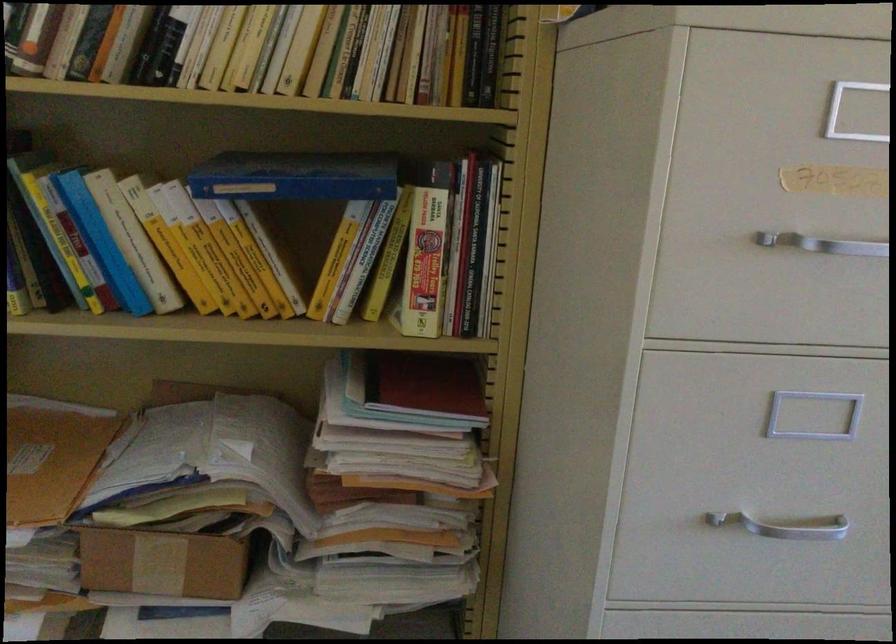
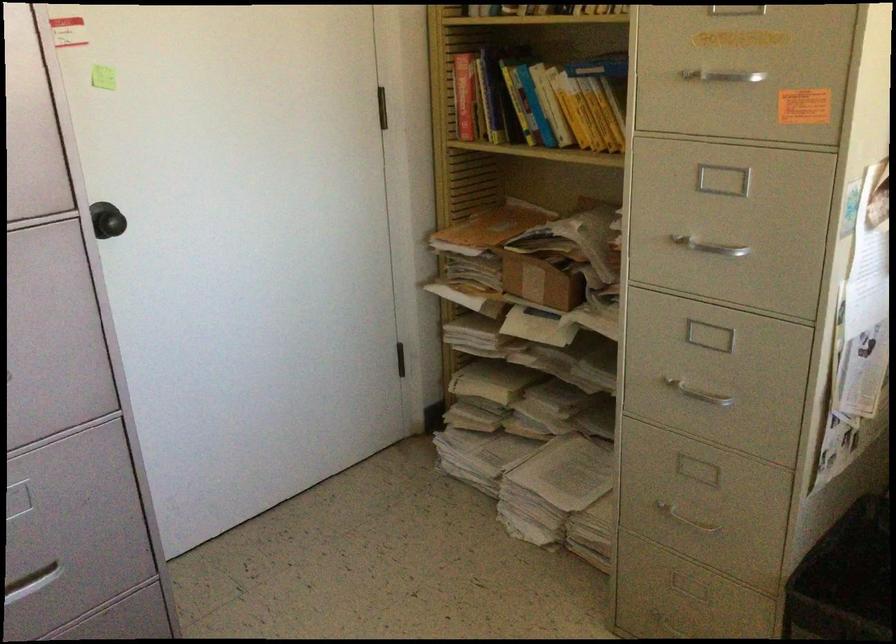
Locate, in the second image, the point that corresponds to point (230, 261) in the first image.

(590, 114)